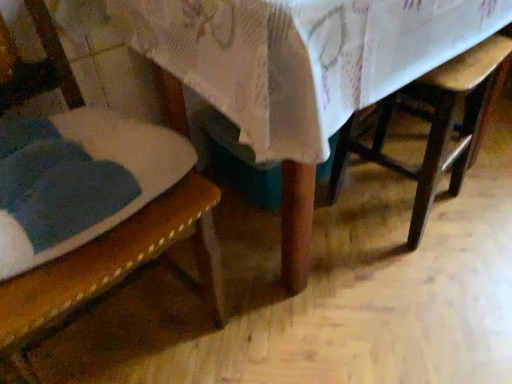
Question: Is wooden table at center beside wooden textured chair at left?

Choices:
 (A) yes
 (B) no

Answer: (B)

Question: Is wooden table at center facing away from wooden textured chair at left?

Choices:
 (A) yes
 (B) no

Answer: (B)

Question: Does wooden table at center have a greater width compared to wooden textured chair at left?

Choices:
 (A) no
 (B) yes

Answer: (B)

Question: From the image's perspective, is wooden table at center beneath wooden textured chair at left?

Choices:
 (A) yes
 (B) no

Answer: (B)

Question: Is wooden table at center in front of wooden textured chair at left?

Choices:
 (A) no
 (B) yes

Answer: (A)

Question: Can you confirm if wooden table at center is smaller than wooden textured chair at left?

Choices:
 (A) yes
 (B) no

Answer: (B)

Question: Would you say wooden chair at lower right is a long distance from wooden textured chair at left?

Choices:
 (A) no
 (B) yes

Answer: (A)

Question: From the image's perspective, is wooden chair at lower right over wooden textured chair at left?

Choices:
 (A) no
 (B) yes

Answer: (B)

Question: Is wooden chair at lower right thinner than wooden textured chair at left?

Choices:
 (A) yes
 (B) no

Answer: (A)

Question: From a real-world perspective, is wooden chair at lower right physically above wooden textured chair at left?

Choices:
 (A) yes
 (B) no

Answer: (B)

Question: Is wooden chair at lower right oriented towards wooden textured chair at left?

Choices:
 (A) no
 (B) yes

Answer: (A)

Question: Is wooden chair at lower right at the right side of wooden textured chair at left?

Choices:
 (A) no
 (B) yes

Answer: (B)

Question: Is wooden chair at lower right shorter than wooden table at center?

Choices:
 (A) no
 (B) yes

Answer: (B)